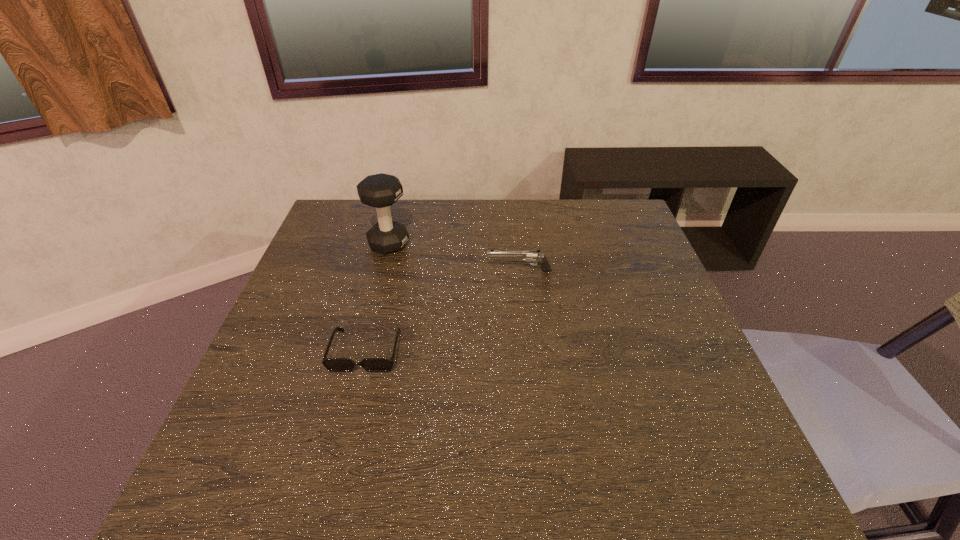
Where is `object that is the second nearest to the tallest object`? This screenshot has width=960, height=540. object that is the second nearest to the tallest object is located at coordinates (331, 364).

I want to click on free space that satisfies the following two spatial constraints: 1. on the front-facing side of the second nearest object; 2. on the front-facing side of the sunglasses, so click(x=527, y=351).

At what (x,y) coordinates should I click in order to perform the action: click on blank space that satisfies the following two spatial constraints: 1. on the front-facing side of the second shortest object; 2. on the front-facing side of the sunglasses. Please return your answer as a coordinate pair (x, y). This screenshot has height=540, width=960. Looking at the image, I should click on (527, 351).